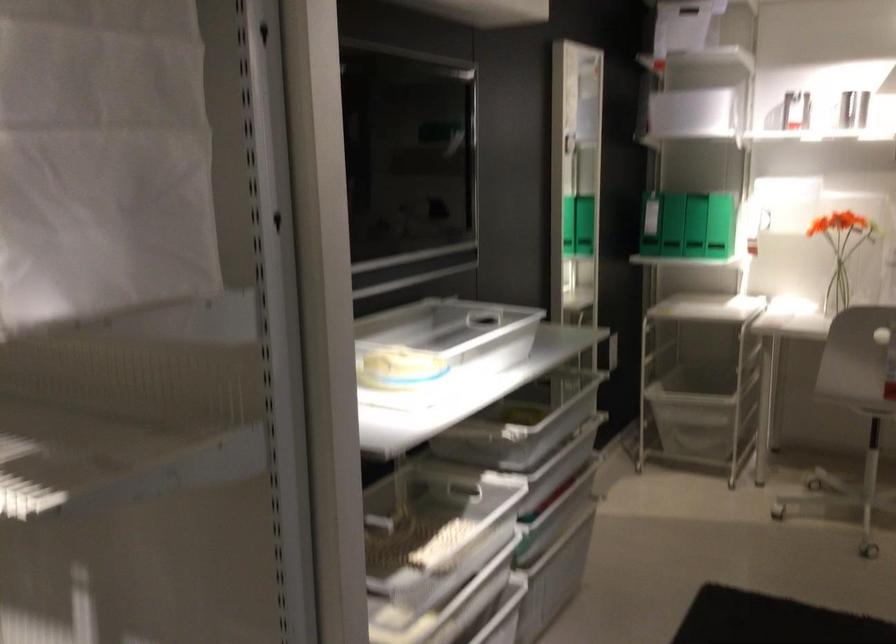
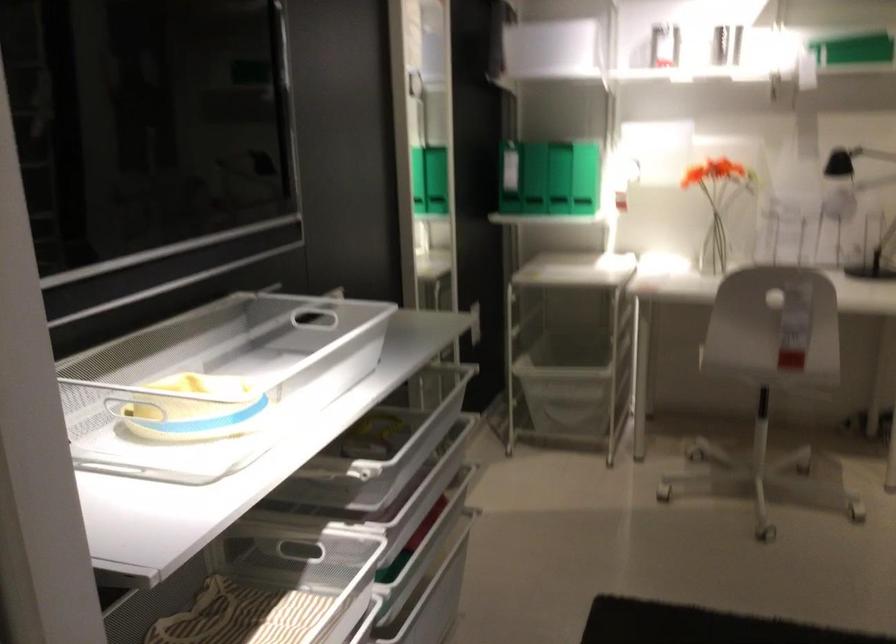
Question: What movement of the cameraman would produce the second image?

Choices:
 (A) Left
 (B) Right
 (C) Forward
 (D) Backward

Answer: (C)